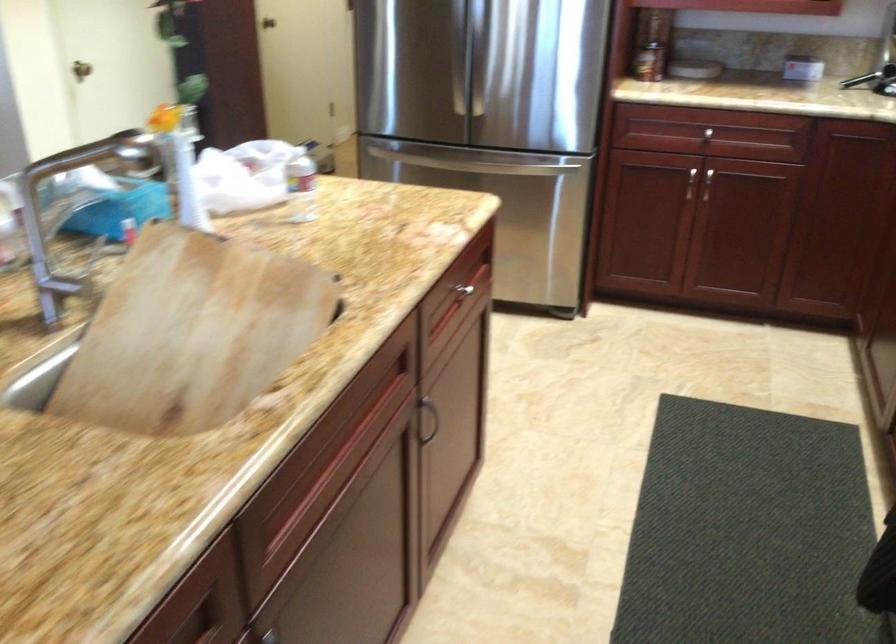
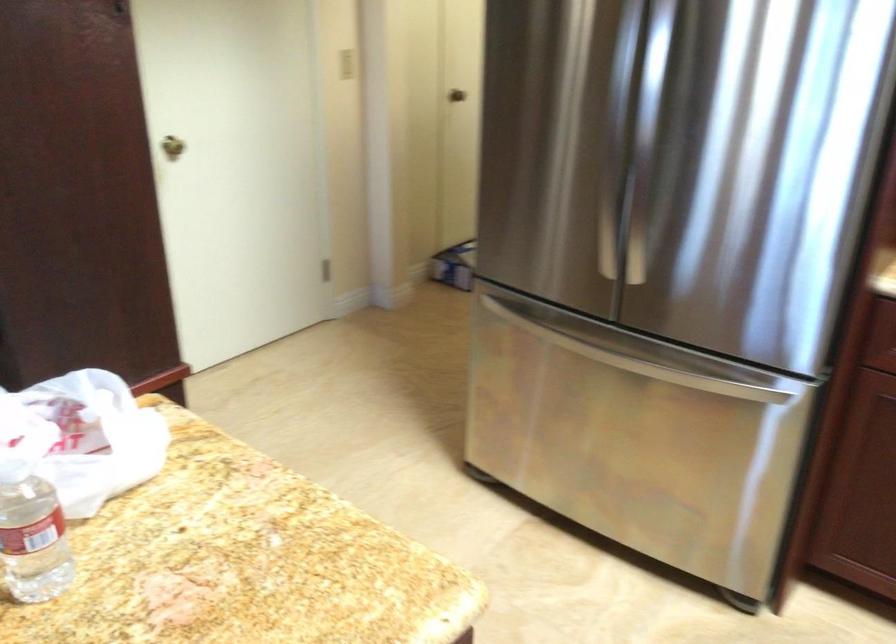
Question: In a continuous first-person perspective shot, in which direction is the camera moving?

Choices:
 (A) Left
 (B) Right
 (C) Forward
 (D) Backward

Answer: (C)